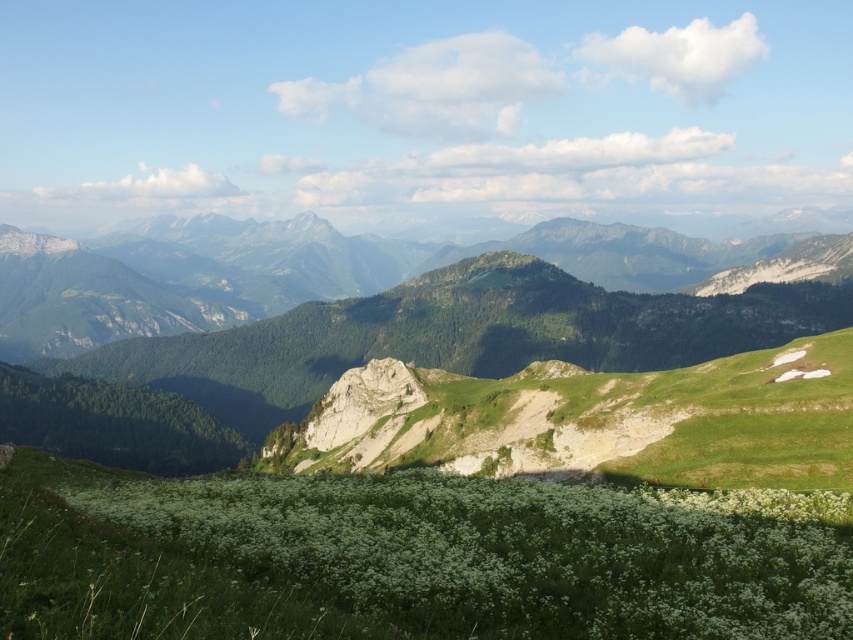
Is point (173, 614) closer to camera compared to point (164, 296)?

Yes, point (173, 614) is in front of point (164, 296).

Does green leafy grass at center have a larger size compared to green grassy mountain range at center?

Incorrect, green leafy grass at center is not larger than green grassy mountain range at center.

Measure the distance between green leafy grass at center and camera.

green leafy grass at center is 21.74 meters from camera.

Find the location of `green leafy grass at center`. green leafy grass at center is located at coordinates (398, 557).